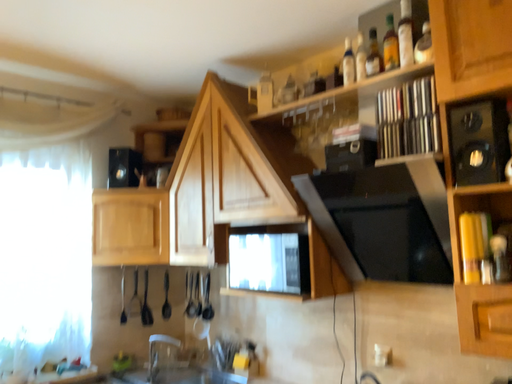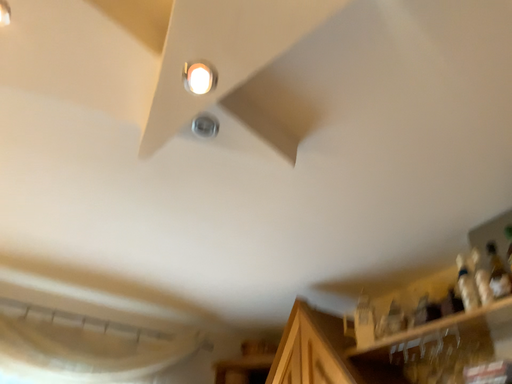
Question: Which way did the camera rotate in the video?

Choices:
 (A) rotated right
 (B) rotated left

Answer: (B)